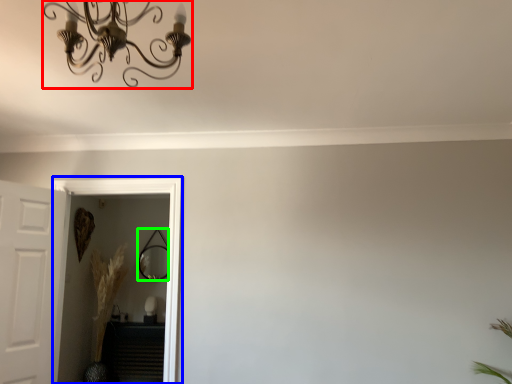
Question: Based on their relative distances, which object is nearer to light fixture (highlighted by a red box)? Choose from glass door (highlighted by a blue box) and mirror (highlighted by a green box).

Choices:
 (A) glass door
 (B) mirror

Answer: (A)